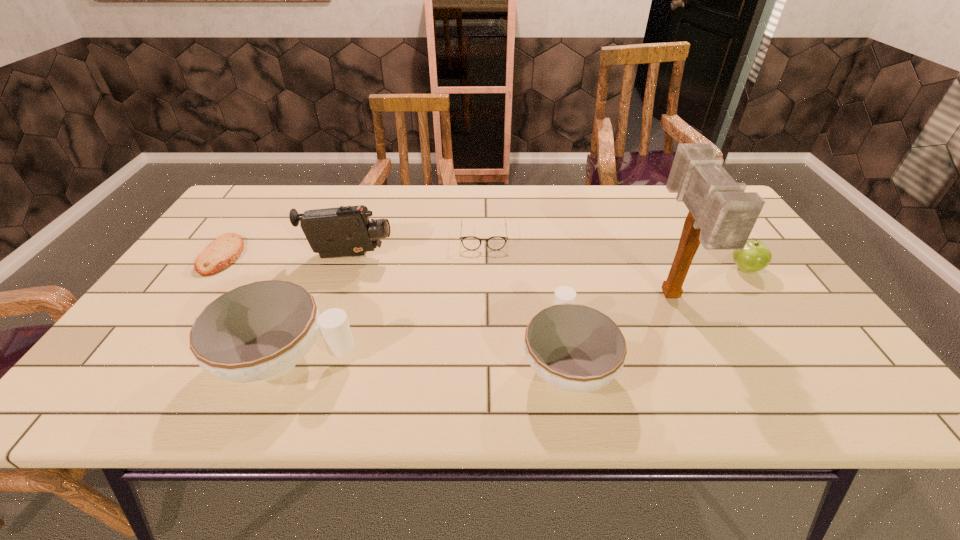
You are a GUI agent. You are given a task and a screenshot of the screen. Output one action in this format:
    pyautogui.click(x=<x>, y=<y>)
    Task: Click on the taller chinaware
    
    Given the screenshot: What is the action you would take?
    pyautogui.click(x=259, y=331)

The width and height of the screenshot is (960, 540). In order to click on the left chinaware in this screenshot , I will do `click(259, 331)`.

Locate an element on the screen. the right chinaware is located at coordinates (575, 348).

Image resolution: width=960 pixels, height=540 pixels. Find the location of `the shorter chinaware`. the shorter chinaware is located at coordinates (575, 348).

Locate an element on the screen. the fourth object from right to left is located at coordinates (495, 243).

In order to click on spectacles in this screenshot , I will do `click(495, 243)`.

Locate an element on the screen. The width and height of the screenshot is (960, 540). camcorder is located at coordinates (343, 231).

Locate an element on the screen. The width and height of the screenshot is (960, 540). apple is located at coordinates (755, 256).

The height and width of the screenshot is (540, 960). Find the location of `pita bread`. pita bread is located at coordinates (221, 253).

The image size is (960, 540). Identify the location of the shortest object. (221, 253).